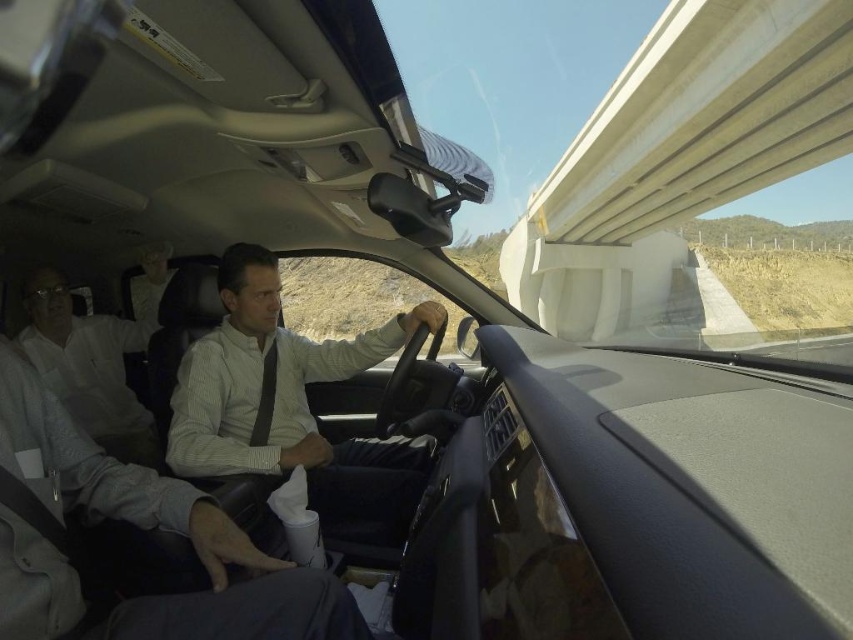
Based on the scene description, where is the white shirt at left located in the image?

The white shirt at left is located at point 0.573 on the x axis and 0.106 on the y axis.

You are a passenger in a car and want to hand a document to the driver. The document is currently at point (292, 403). The driver is wearing a dark tie and has both hands on the steering wheel. Can you reach the document from your seat without moving your arm across the driver?

The document is at point (292, 403) where the white striped shirt at center is located. Since the driver is wearing a dark tie and has both hands on the steering wheel, the passenger can reach the document at that point without moving their arm across the driver, as it is positioned at the center where the white striped shirt is.

You are a passenger in the car and want to hand a document to the driver. The document is on the passenger seat. Which direction should you lean to reach the driver without blocking the view of the road? The white striped shirt at center and white shirt at left are in your line of sight.

You should lean towards the right side of the passenger seat to avoid blocking the driver and reach them. The white striped shirt at center is positioned under the white shirt at left, so leaning right would allow you to reach the driver while avoiding obstruction.